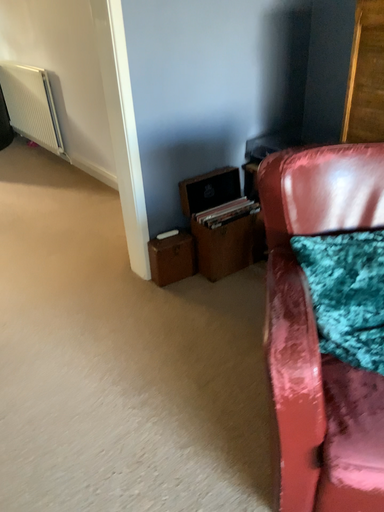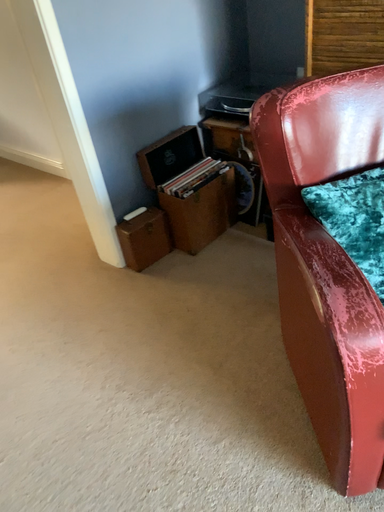
Question: Which way did the camera rotate in the video?

Choices:
 (A) rotated right
 (B) rotated left

Answer: (A)